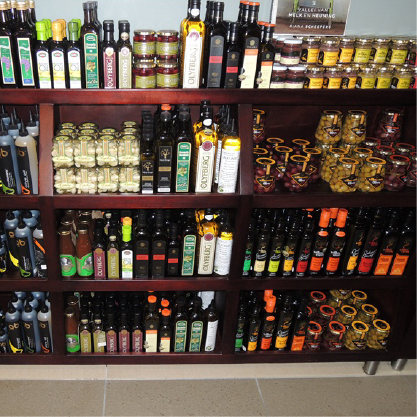
Identify the location of wall frame hanging. The image size is (417, 417). (299, 10).